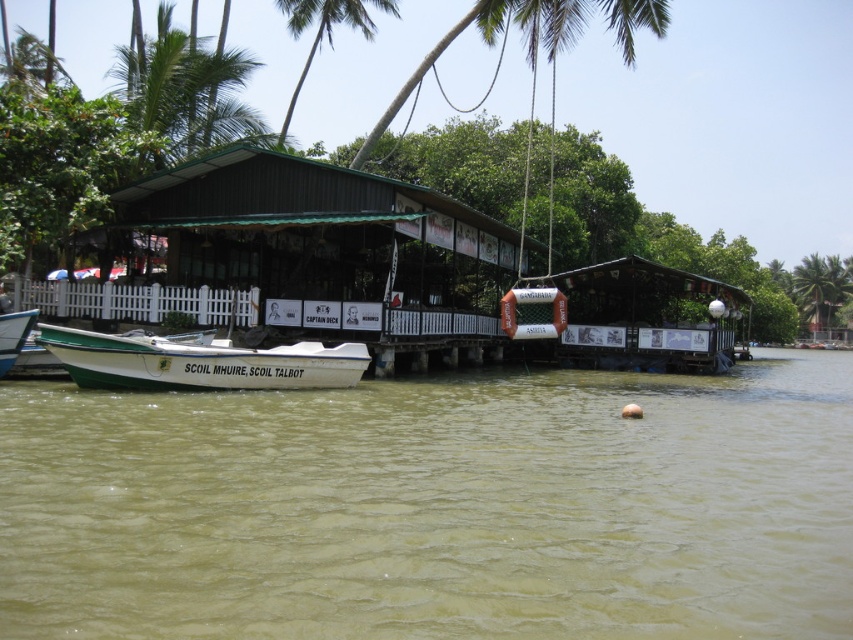
The image size is (853, 640). What do you see at coordinates (199, 362) in the screenshot? I see `white matte boat at center` at bounding box center [199, 362].

In the scene shown: Which is more to the left, white matte boat at center or green leafy palm tree at upper right?

From the viewer's perspective, white matte boat at center appears more on the left side.

I want to click on white matte boat at center, so click(x=199, y=362).

Where is `white matte boat at center`? This screenshot has height=640, width=853. white matte boat at center is located at coordinates click(199, 362).

Does green leafy palm tree at upper left have a greater height compared to green leafy palm tree at upper right?

Yes, green leafy palm tree at upper left is taller than green leafy palm tree at upper right.

Based on the photo, does green leafy palm tree at upper left appear on the right side of green leafy palm tree at upper right?

In fact, green leafy palm tree at upper left is to the left of green leafy palm tree at upper right.

Which is in front, point (241, 134) or point (827, 300)?

Point (241, 134) is more forward.

This screenshot has height=640, width=853. Find the location of `green leafy palm tree at upper left`. green leafy palm tree at upper left is located at coordinates (184, 92).

Which is more to the right, green leafy palm tree at upper center or green leafy palm tree at upper right?

green leafy palm tree at upper right is more to the right.

Can you confirm if green leafy palm tree at upper center is smaller than green leafy palm tree at upper right?

No.

Between point (306, 13) and point (822, 304), which one is positioned in front?

Point (306, 13) is more forward.

Where is `green leafy palm tree at upper center`? green leafy palm tree at upper center is located at coordinates (326, 29).